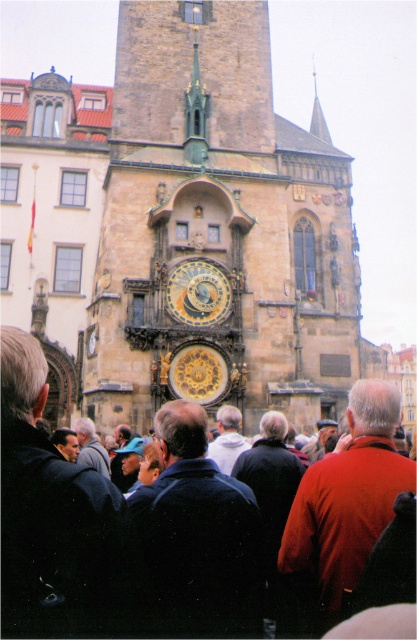
Question: Which object is closer to the camera taking this photo?

Choices:
 (A) dark brown leather jacket at center
 (B) stone clock tower at center

Answer: (A)

Question: Which of the following is the closest to the observer?

Choices:
 (A) dark brown leather jacket at center
 (B) stone clock tower at center
 (C) red wool sweater at center
 (D) smooth silver spire at upper center

Answer: (A)

Question: Can you confirm if dark brown leather jacket at center is smaller than gold/yellow metal/brass clock at center?

Choices:
 (A) no
 (B) yes

Answer: (A)

Question: Does dark brown leather jacket at center have a smaller size compared to gold/yellow metal/brass clock at center?

Choices:
 (A) yes
 (B) no

Answer: (B)

Question: Which is farther from the smooth silver spire at upper center?

Choices:
 (A) dark brown leather jacket at center
 (B) red wool sweater at center
 (C) stone clock tower at center

Answer: (A)

Question: Where is dark brown leather jacket at center located in relation to red wool sweater at center in the image?

Choices:
 (A) left
 (B) right

Answer: (A)